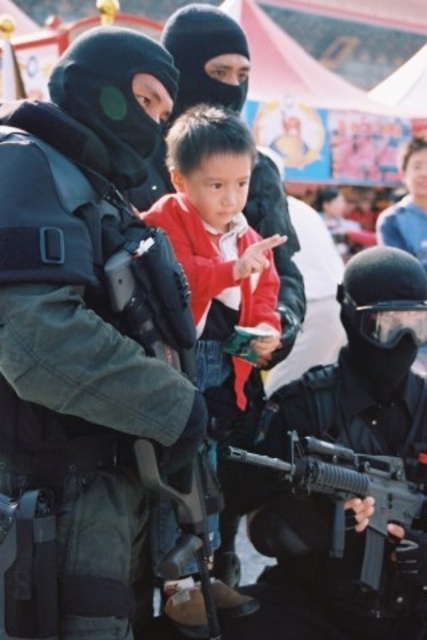
Measure the distance between red matte jacket at center and matte black rifle at lower center.

red matte jacket at center and matte black rifle at lower center are 27.99 feet apart from each other.

Is red matte jacket at center below matte black rifle at lower center?

No, red matte jacket at center is not below matte black rifle at lower center.

Describe the element at coordinates (218, 241) in the screenshot. I see `red matte jacket at center` at that location.

This screenshot has height=640, width=427. In order to click on red matte jacket at center in this screenshot , I will do `click(218, 241)`.

Who is taller, matte black tactical vest at center or red matte jacket at center?

matte black tactical vest at center

Is matte black tactical vest at center smaller than red matte jacket at center?

No, matte black tactical vest at center is not smaller than red matte jacket at center.

What do you see at coordinates (85, 340) in the screenshot? The height and width of the screenshot is (640, 427). I see `matte black tactical vest at center` at bounding box center [85, 340].

At what (x,y) coordinates should I click in order to perform the action: click on matte black tactical vest at center. Please return your answer as a coordinate pair (x, y). The width and height of the screenshot is (427, 640). Looking at the image, I should click on (85, 340).

Which is more to the right, matte black tactical vest at center or matte black rifle at lower center?

matte black rifle at lower center

Is matte black tactical vest at center below matte black rifle at lower center?

No, matte black tactical vest at center is not below matte black rifle at lower center.

What do you see at coordinates (85, 340) in the screenshot?
I see `matte black tactical vest at center` at bounding box center [85, 340].

Find the location of a particular element. The width and height of the screenshot is (427, 640). matte black tactical vest at center is located at coordinates (85, 340).